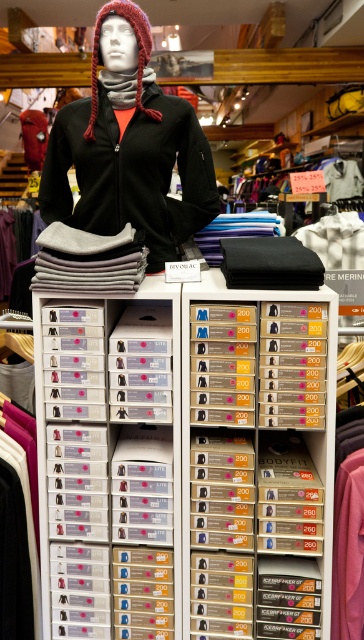
Question: Is clear plastic boxes at center further to camera compared to clear plastic drawer at center?

Choices:
 (A) no
 (B) yes

Answer: (A)

Question: Which object appears farthest from the camera in this image?

Choices:
 (A) clear plastic drawer at center
 (B) clear plastic shoebox at center
 (C) clear plastic boxes at center

Answer: (B)

Question: Considering the real-world distances, which object is closest to the clear plastic boxes at center?

Choices:
 (A) pink fabric at lower right
 (B) clear plastic drawer at center

Answer: (B)

Question: Which point is farther to the camera?

Choices:
 (A) clear plastic boxes at center
 (B) clear plastic shoebox at center
 (C) pink fabric at lower right
 (D) clear plastic drawer at center

Answer: (B)

Question: Observing the image, what is the correct spatial positioning of matte black jacket at center in reference to pink fabric at lower right?

Choices:
 (A) right
 (B) left

Answer: (B)

Question: Can you confirm if clear plastic boxes at center is positioned to the right of clear plastic drawer at center?

Choices:
 (A) no
 (B) yes

Answer: (A)